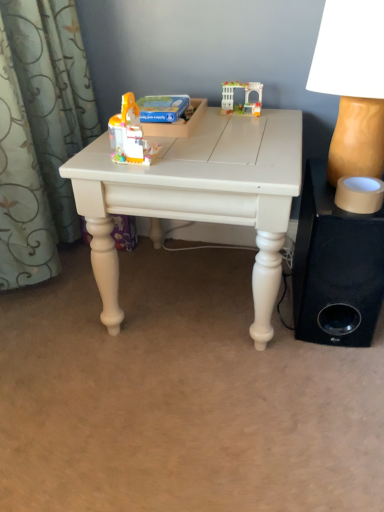
The image size is (384, 512). Find the location of `free spot to the left of black fabric speaker at lower right`. free spot to the left of black fabric speaker at lower right is located at coordinates (233, 312).